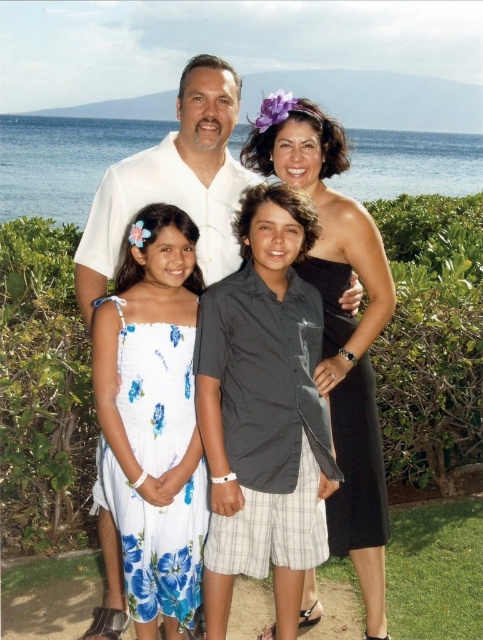
Question: Which object is positioned farthest from the black satin dress at center?

Choices:
 (A) dark gray satin shirt at center
 (B) white floral dress at center

Answer: (B)

Question: Which object is farther from the camera taking this photo?

Choices:
 (A) white floral dress at center
 (B) dark gray satin shirt at center
 (C) white matte shirt at center

Answer: (C)

Question: Is dark gray satin shirt at center to the left of white matte shirt at center from the viewer's perspective?

Choices:
 (A) no
 (B) yes

Answer: (A)

Question: Based on their relative distances, which object is nearer to the white matte shirt at center?

Choices:
 (A) white floral dress at center
 (B) dark gray satin shirt at center

Answer: (A)

Question: Does dark gray satin shirt at center appear on the left side of black satin dress at center?

Choices:
 (A) yes
 (B) no

Answer: (A)

Question: Does dark gray satin shirt at center come in front of white matte shirt at center?

Choices:
 (A) no
 (B) yes

Answer: (B)